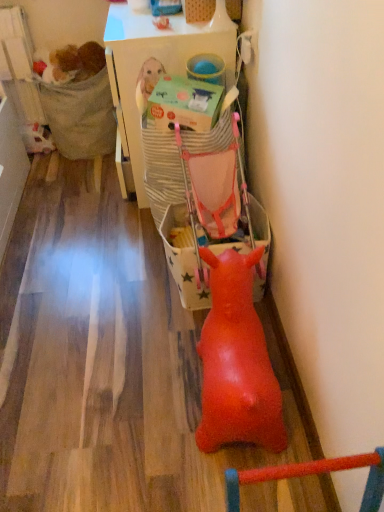
At what (x,y) coordinates should I click in order to perform the action: click on free space between white plastic table at upper center and textured fabric chair at left. Please return your answer as a coordinate pair (x, y). Looking at the image, I should click on (93, 179).